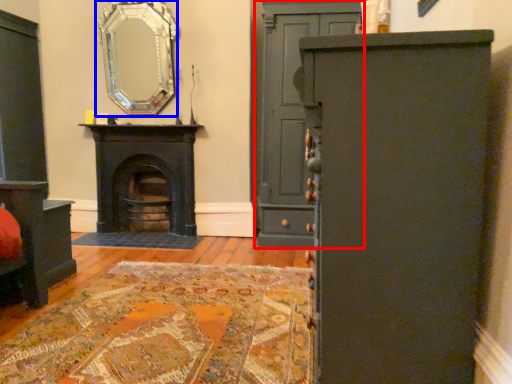
Question: Which object appears closest to the camera in this image, door (highlighted by a red box) or mirror (highlighted by a blue box)?

Choices:
 (A) door
 (B) mirror

Answer: (A)